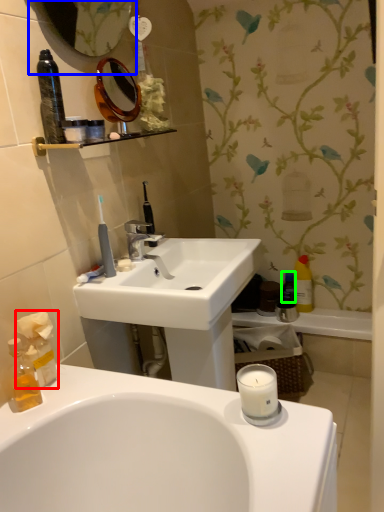
Question: Considering the real-world distances, which object is closest to tissue (highlighted by a red box)? mirror (highlighted by a blue box) or mouthwash (highlighted by a green box).

Choices:
 (A) mirror
 (B) mouthwash

Answer: (A)